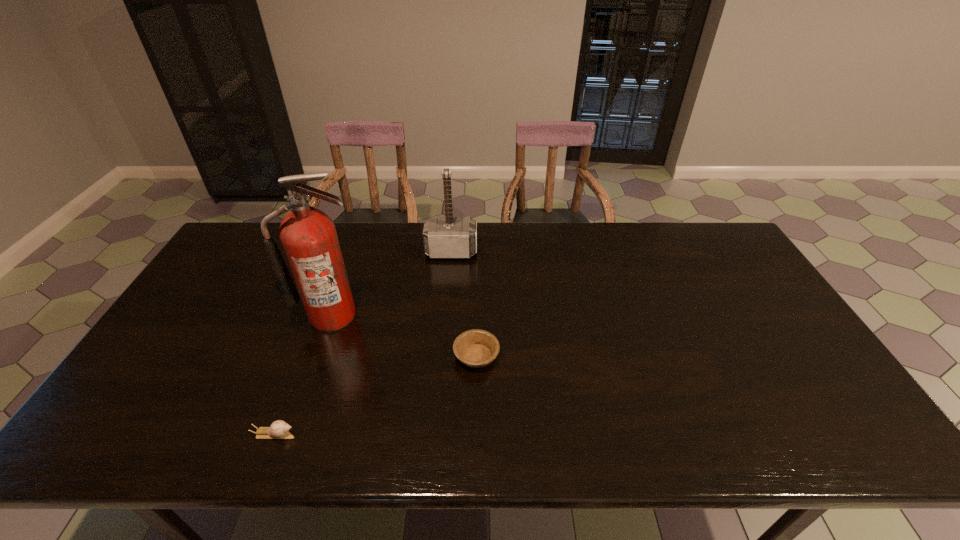
Where is `vacant space in between the fire extinguisher and the nearest object`? vacant space in between the fire extinguisher and the nearest object is located at coordinates (303, 375).

Locate an element on the screen. vacant region between the escargot and the tallest object is located at coordinates (303, 375).

Find the location of a particular element. The image size is (960, 540). vacant space that is in between the escargot and the farthest object is located at coordinates (363, 343).

The image size is (960, 540). I want to click on empty space that is in between the farthest object and the second farthest object, so click(x=392, y=284).

Identify the location of free spot between the second nearest object and the hammer. (464, 304).

I want to click on free point between the escargot and the bowl, so click(375, 395).

The height and width of the screenshot is (540, 960). What are the coordinates of `vacant space that is in between the fire extinguisher and the farthest object` in the screenshot? It's located at (392, 284).

What are the coordinates of `the third closest object to the second tallest object` in the screenshot? It's located at (279, 429).

This screenshot has width=960, height=540. I want to click on the third closest object relative to the farthest object, so click(x=279, y=429).

Locate an element on the screen. Image resolution: width=960 pixels, height=540 pixels. vacant area in the image that satisfies the following two spatial constraints: 1. for striking with the head of the bowl; 2. on the left side of the second tallest object is located at coordinates (444, 356).